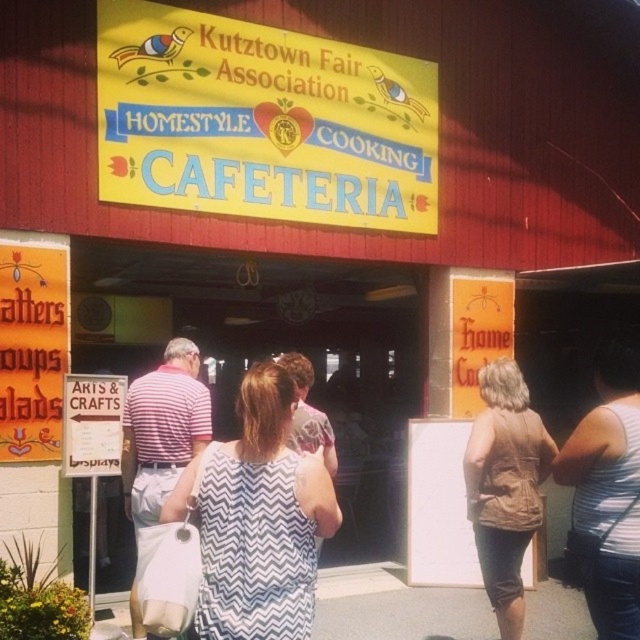
Who is taller, yellow paper sign at upper center or white zigzag dress at center?

With more height is yellow paper sign at upper center.

Is point (298, 184) positioned before point (307, 557)?

No, it is not.

Which is behind, point (360, 172) or point (282, 568)?

The point (360, 172) is more distant.

The image size is (640, 640). In order to click on yellow paper sign at upper center in this screenshot , I will do `click(260, 122)`.

Can you confirm if yellow paper sign at upper center is positioned below white tank top at right?

No.

Between point (259, 116) and point (628, 365), which one is positioned in front?

Point (628, 365)

Find the location of `yellow paper sign at upper center`. yellow paper sign at upper center is located at coordinates (260, 122).

Is point (259, 451) in front of point (428, 554)?

Yes, it is.

Does white zigzag dress at center appear on the right side of white matte bulletin board at center?

Incorrect, white zigzag dress at center is not on the right side of white matte bulletin board at center.

Does point (225, 548) come farther from viewer compared to point (432, 524)?

No, it is not.

I want to click on white zigzag dress at center, so click(257, 518).